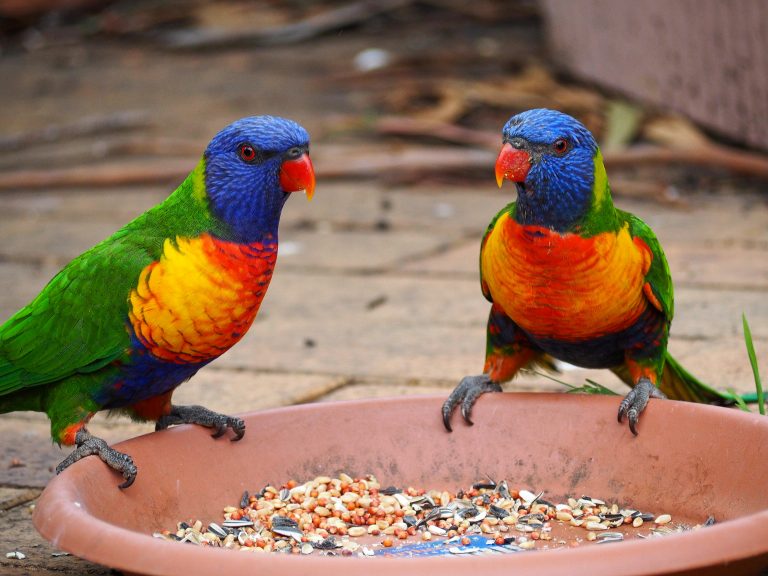
Locate an element on the screen. The height and width of the screenshot is (576, 768). inside of dish is located at coordinates (392, 457).